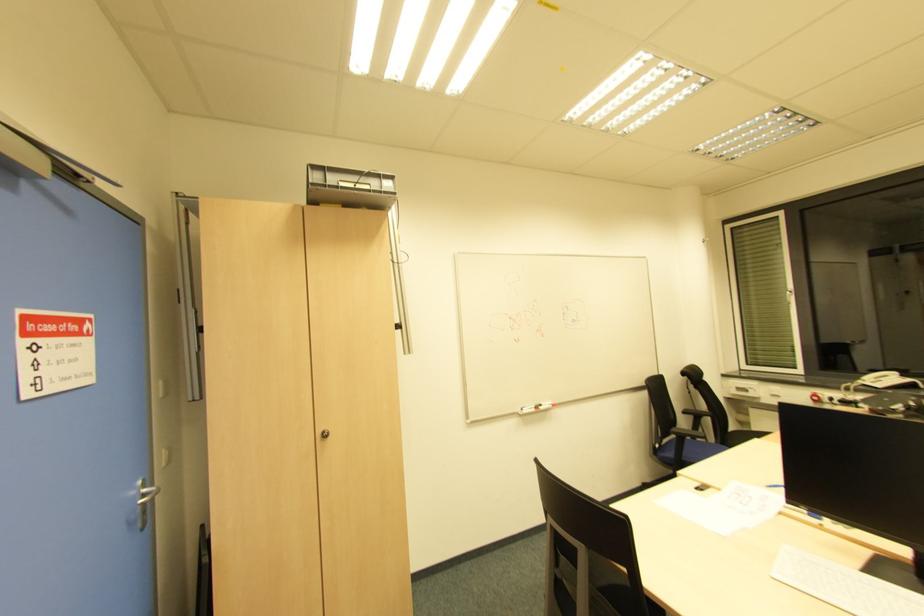
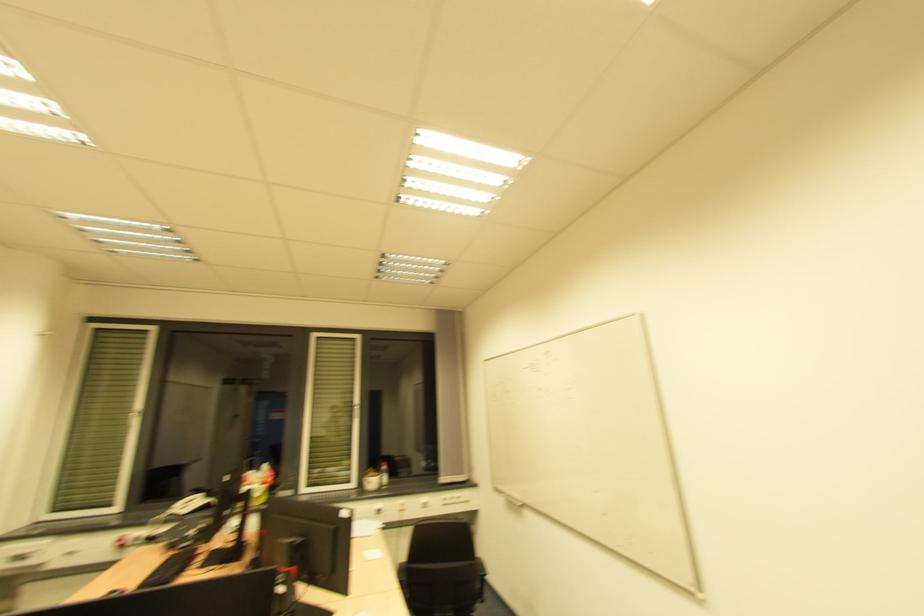
Where in the second image is the point corresponding to pixel 858 379 from the first image?

(169, 509)